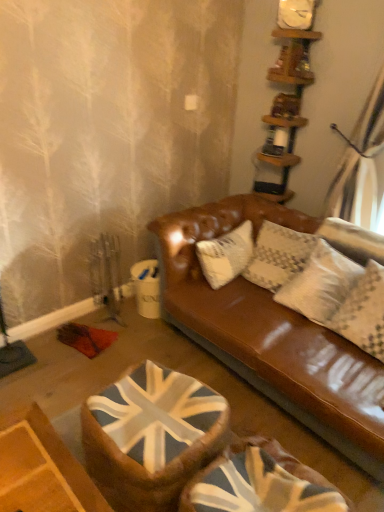
Question: Considering the positions of point (281, 14) and point (279, 74), is point (281, 14) closer or farther from the camera than point (279, 74)?

Choices:
 (A) farther
 (B) closer

Answer: (B)

Question: From the image's perspective, is white matte clock at upper center above or below wooden shelves at upper right?

Choices:
 (A) above
 (B) below

Answer: (A)

Question: Considering the real-world distances, which object is farthest from the union jack fabric swivel chair at center, which ranks as the first swivel chair in left-to-right order?

Choices:
 (A) wooden shelves at upper right
 (B) white matte clock at upper center
 (C) union jack fabric swivel chair at lower center, which is the 2th swivel chair from left to right
 (D) white textured pillow at upper right

Answer: (B)

Question: Which object is the farthest from the union jack fabric swivel chair at lower center, which is the 2th swivel chair from left to right?

Choices:
 (A) wooden shelves at upper right
 (B) white matte clock at upper center
 (C) white textured pillow at upper right
 (D) union jack fabric swivel chair at center, which ranks as the first swivel chair in left-to-right order

Answer: (B)